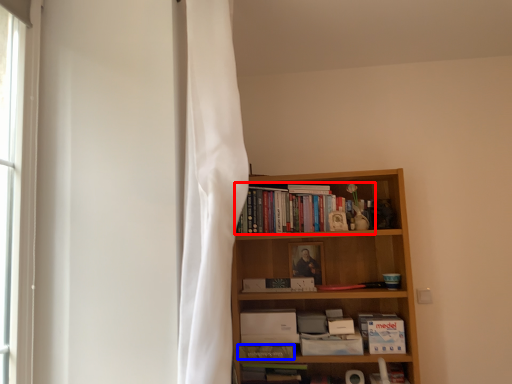
Question: Which object appears closest to the camera in this image, book (highlighted by a red box) or paperback book (highlighted by a blue box)?

Choices:
 (A) book
 (B) paperback book

Answer: (B)